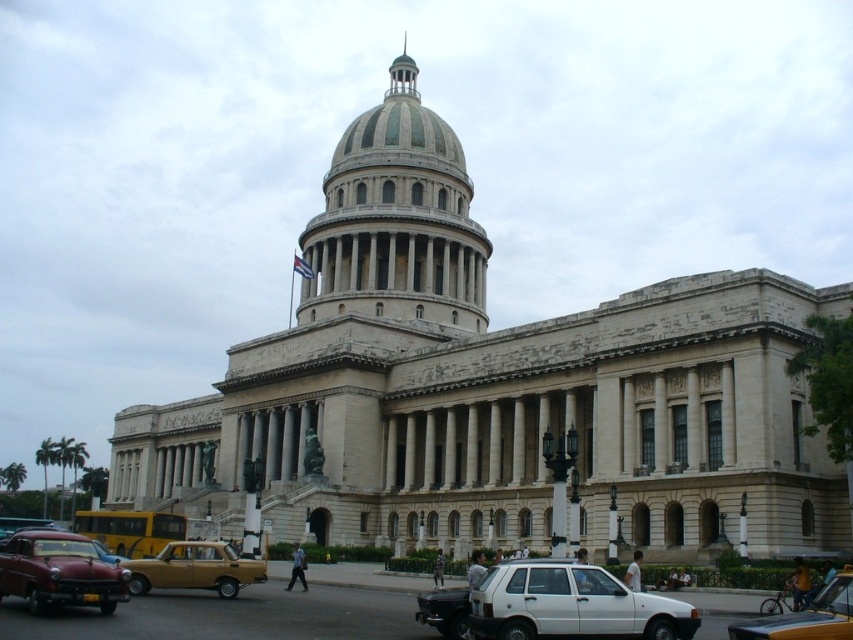
You are standing in front of the grand neoclassical building and see the green marble dome at center and the shiny red car at lower left. Which object is positioned to the right of the other?

The green marble dome at center is positioned to the right of the shiny red car at lower left.

You are standing in front of the grand neoclassical building and want to take a photo. You notice two points marked as point 1 and point 2 on the building. Point 1 is at coordinates point (598, 609) and point 2 is at point (770, 618). Which point is closer to your camera lens when taking the photo?

Point (598, 609) is closer to the camera lens than point (770, 618) because it is further to the camera according to the description.

You are standing in front of the grand neoclassical building and want to walk from point A to point B. Point A is at coordinates point (410, 132) and point B is at coordinates point (143, 586). Since you need to avoid obstacles, can you tell me which point is closer to the entrance of the building?

Point (143, 586) is closer to the entrance of the building because it is in front of point (410, 132), which is behind it.